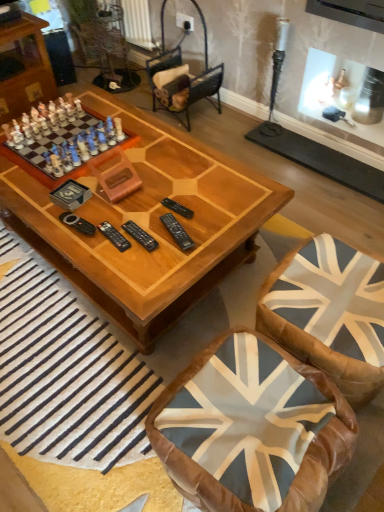
Find the location of `unoccupied region to the right of black plastic remote at center`. unoccupied region to the right of black plastic remote at center is located at coordinates (x=185, y=236).